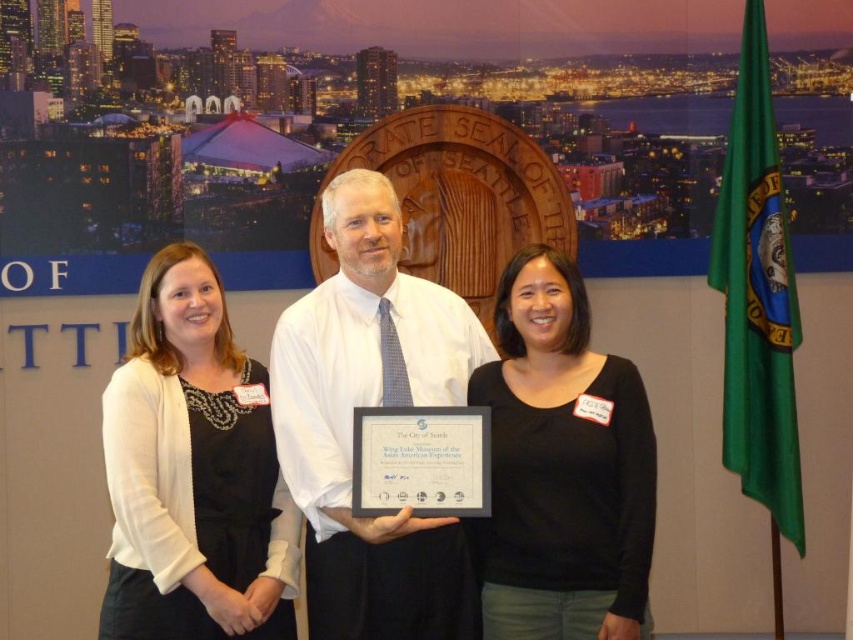
Measure the distance between black matte dress at left and camera.

black matte dress at left and camera are 4.16 meters apart from each other.

Is point (161, 544) farther from viewer compared to point (577, 516)?

No, it is in front of (577, 516).

What do you see at coordinates (193, 472) in the screenshot?
I see `black matte dress at left` at bounding box center [193, 472].

Identify the location of black matte dress at left. The width and height of the screenshot is (853, 640). (193, 472).

Is black matte shirt at center closer to camera compared to white paper at center?

That is True.

Is black matte shirt at center smaller than white paper at center?

No, black matte shirt at center is not smaller than white paper at center.

Which is behind, point (561, 616) or point (447, 406)?

The point (447, 406) is behind.

Where is `black matte shirt at center`? Image resolution: width=853 pixels, height=640 pixels. black matte shirt at center is located at coordinates point(561,467).

Who is taller, white shirt at center or black matte shirt at center?

With more height is white shirt at center.

Find the location of `white shirt at center`. white shirt at center is located at coordinates (370, 404).